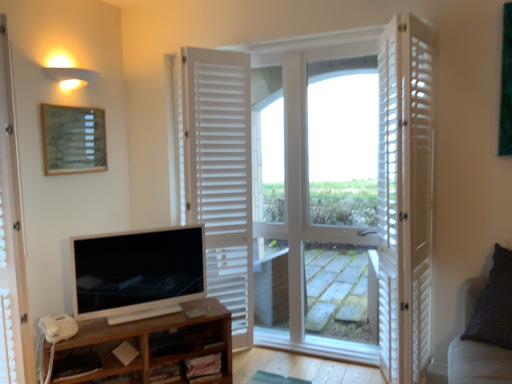
This screenshot has height=384, width=512. What are the coordinates of `free space that is in between white plastic phone at lower left and white glossy television at lower left` in the screenshot? It's located at (124, 319).